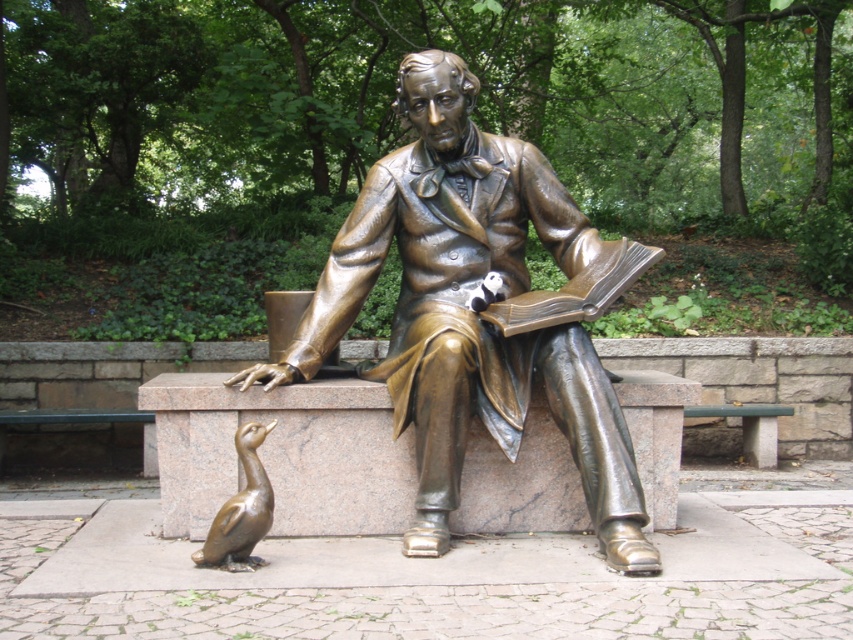
You are a tour guide leading a group near the bronze statue at center and the shiny bronze duckling at lower left. You want to place a 3.5 feet long bench between them. Will there be enough space to place the bench without moving either object?

The bronze statue at center and the shiny bronze duckling at lower left are 3.31 feet apart. Since the bench is 3.5 feet long, which is slightly longer than the distance between them, there isn not enough space to place the bench without moving either object.

You are standing at the point marked by the coordinates point [469,310] in the image. Based on the scene description, which object are you currently standing on?

You are standing on the bronze statue at center, as the point [469,310] is located on it according to the description.

Consider the image. You are a tour guide explaining the layout of the statue and duckling to visitors. Point out the position of the bronze statue at center relative to the shiny bronze duckling at lower left.

The bronze statue at center is located to the right of the shiny bronze duckling at lower left.